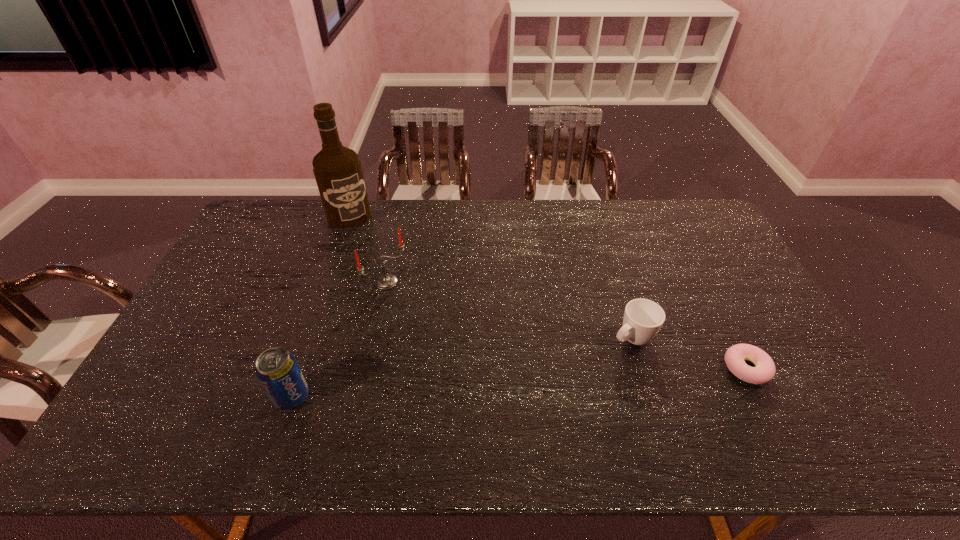
Find the location of a particular element. free spot between the rightmost object and the third object from left to right is located at coordinates 566,325.

This screenshot has height=540, width=960. In order to click on vacant space that is in between the fourth tallest object and the farthest object in this screenshot , I will do `click(491, 277)`.

Where is `empty space that is in between the alcohol and the fourth tallest object`? The width and height of the screenshot is (960, 540). empty space that is in between the alcohol and the fourth tallest object is located at coordinates (491, 277).

The width and height of the screenshot is (960, 540). I want to click on free point between the shortest object and the alcohol, so click(548, 292).

At what (x,y) coordinates should I click in order to perform the action: click on free space between the rightmost object and the farthest object. Please return your answer as a coordinate pair (x, y). The height and width of the screenshot is (540, 960). Looking at the image, I should click on (548, 292).

Where is `vacant region between the doughnut and the third tallest object`? vacant region between the doughnut and the third tallest object is located at coordinates (519, 382).

In order to click on free space between the alcohol and the third tallest object in this screenshot , I will do `click(321, 306)`.

Identify the location of unoccupied area between the second farthest object and the alcohol. This screenshot has height=540, width=960. (368, 249).

The image size is (960, 540). Identify the location of free space between the tallest object and the second object from right to left. (491, 277).

You are a GUI agent. You are given a task and a screenshot of the screen. Output one action in this format:
    pyautogui.click(x=<x>, y=<y>)
    Task: Click on the free space between the rightmost object and the alcohol
    The height and width of the screenshot is (540, 960).
    Given the screenshot: What is the action you would take?
    pyautogui.click(x=548, y=292)